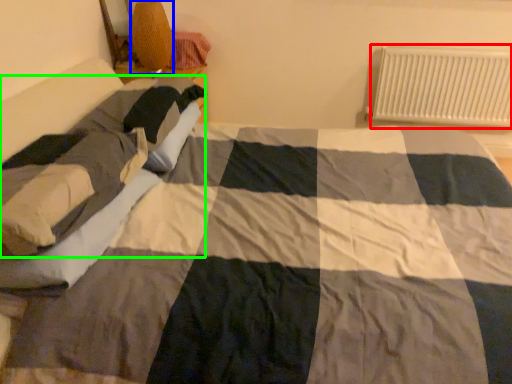
Question: Which is farther away from radiator (highlighted by a red box)? lamp (highlighted by a blue box) or person (highlighted by a green box)?

Choices:
 (A) lamp
 (B) person

Answer: (B)